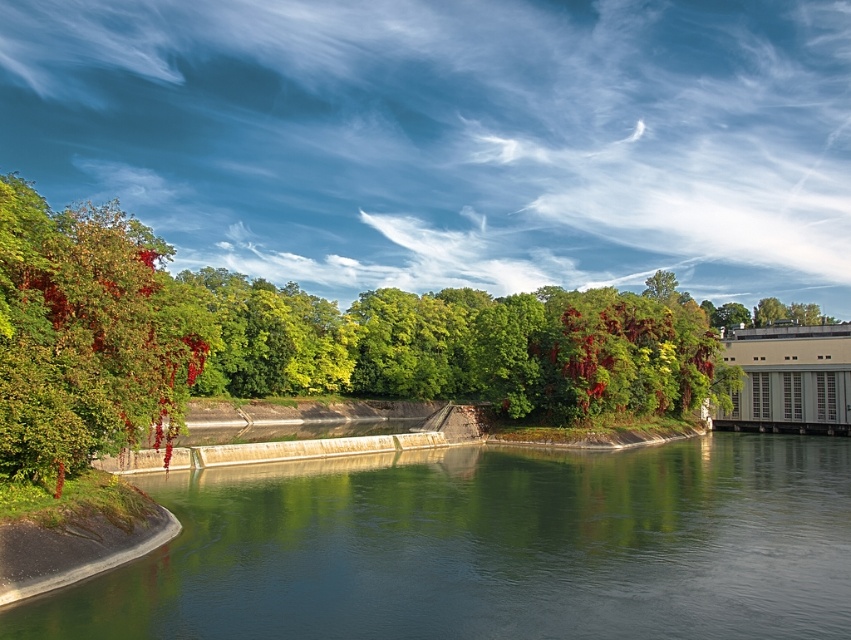
Question: Does green concrete river at lower left lie behind shiny red berries at left?

Choices:
 (A) no
 (B) yes

Answer: (A)

Question: Which of the following is the closest to the observer?

Choices:
 (A) (338, 576)
 (B) (52, 356)

Answer: (A)

Question: Is green concrete river at lower left bigger than shiny red berries at left?

Choices:
 (A) yes
 (B) no

Answer: (B)

Question: Is green concrete river at lower left below shiny red berries at left?

Choices:
 (A) no
 (B) yes

Answer: (B)